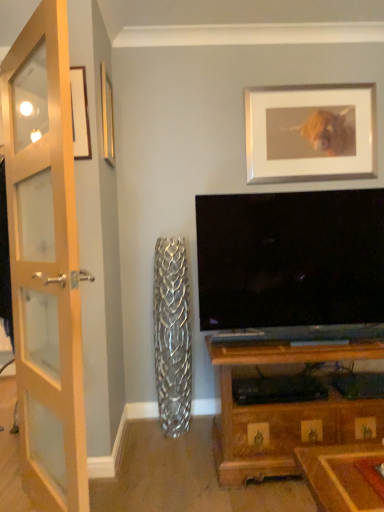
In order to click on vacant space situated above silver/metallic picture frame at upper center, the 2th picture frame viewed from the front (from a real-world perspective) in this screenshot , I will do `click(316, 82)`.